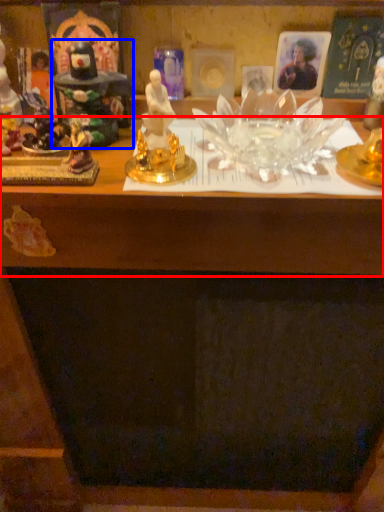
Question: Among these objects, which one is nearest to the camera, table (highlighted by a red box) or toy (highlighted by a blue box)?

Choices:
 (A) table
 (B) toy

Answer: (A)